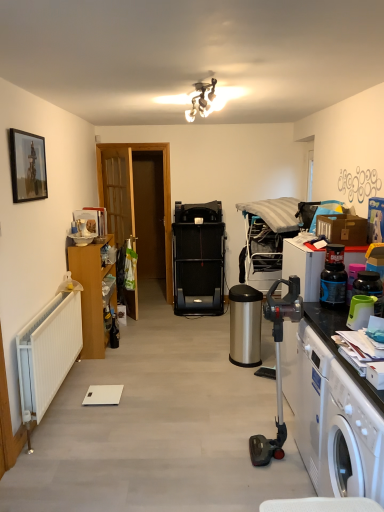
Question: Is wooden door at left smaller than metallic chrome light fixture at upper center?

Choices:
 (A) no
 (B) yes

Answer: (A)

Question: Is wooden door at left at the left side of metallic chrome light fixture at upper center?

Choices:
 (A) yes
 (B) no

Answer: (A)

Question: Is wooden door at left turned away from metallic chrome light fixture at upper center?

Choices:
 (A) yes
 (B) no

Answer: (B)

Question: Is wooden door at left to the right of metallic chrome light fixture at upper center from the viewer's perspective?

Choices:
 (A) no
 (B) yes

Answer: (A)

Question: From the image's perspective, is wooden door at left above metallic chrome light fixture at upper center?

Choices:
 (A) no
 (B) yes

Answer: (A)

Question: Is wooden door at left taller than metallic chrome light fixture at upper center?

Choices:
 (A) no
 (B) yes

Answer: (B)

Question: Is wooden door at left taller than wooden cabinet at left?

Choices:
 (A) yes
 (B) no

Answer: (A)

Question: Is wooden door at left shorter than wooden cabinet at left?

Choices:
 (A) no
 (B) yes

Answer: (A)

Question: Would you say wooden door at left contains wooden cabinet at left?

Choices:
 (A) yes
 (B) no

Answer: (B)

Question: From the image's perspective, does wooden door at left appear lower than wooden cabinet at left?

Choices:
 (A) yes
 (B) no

Answer: (B)

Question: Are wooden door at left and wooden cabinet at left far apart?

Choices:
 (A) no
 (B) yes

Answer: (B)

Question: Could you tell me if wooden door at left is turned towards wooden cabinet at left?

Choices:
 (A) no
 (B) yes

Answer: (A)

Question: Can you confirm if blue plastic bottle at right is thinner than white plastic washing machine at lower right?

Choices:
 (A) no
 (B) yes

Answer: (B)